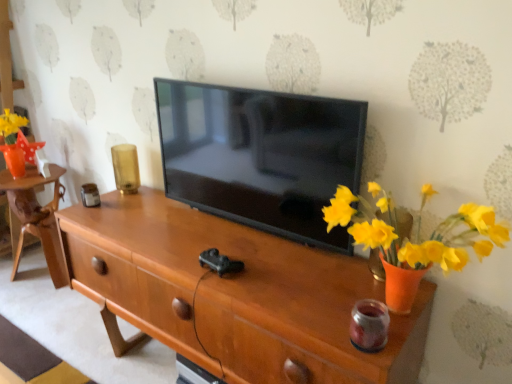
Locate an element on the screen. black glossy tv at center is located at coordinates (261, 156).

Image resolution: width=512 pixels, height=384 pixels. Describe the element at coordinates (6, 59) in the screenshot. I see `wooden cabinet at left` at that location.

Locate an element on the screen. wooden tv stand at center is located at coordinates (233, 295).

From the image's perspective, which is below, wooden table at left or wooden cabinet at left?

wooden table at left.

Is there a large distance between wooden table at left and wooden cabinet at left?

They are positioned close to each other.

Is point (60, 250) in front of point (14, 225)?

Yes, it is in front of point (14, 225).

Which object is thinner, wooden table at left or wooden cabinet at left?

With smaller width is wooden cabinet at left.

From a real-world perspective, is wooden tv stand at center located beneath wooden cabinet at left?

Yes, from a real-world perspective, wooden tv stand at center is under wooden cabinet at left.

Is wooden tv stand at center bigger than wooden cabinet at left?

Yes, wooden tv stand at center is bigger than wooden cabinet at left.

Is wooden tv stand at center outside of wooden cabinet at left?

Yes, wooden tv stand at center is located beyond the bounds of wooden cabinet at left.

Measure the distance between wooden tv stand at center and wooden cabinet at left.

wooden tv stand at center and wooden cabinet at left are 6.07 feet apart.

Is wooden table at left facing away from wooden tv stand at center?

That's not correct — wooden table at left is not looking away from wooden tv stand at center.

Where is `desk positioned vertically above the wooden table at left (from a real-world perspective)`? Image resolution: width=512 pixels, height=384 pixels. desk positioned vertically above the wooden table at left (from a real-world perspective) is located at coordinates (233, 295).

Which object is closer to the camera, wooden table at left or wooden tv stand at center?

wooden tv stand at center is in front.

The image size is (512, 384). I want to click on television above the wooden table at left (from the image's perspective), so click(261, 156).

Is wooden table at left taller than black glossy tv at center?

Correct, wooden table at left is much taller as black glossy tv at center.

Does point (31, 191) come behind point (211, 180)?

Yes, point (31, 191) is farther from viewer.

In the scene shown: Can you confirm if black glossy tv at center is taller than wooden cabinet at left?

In fact, black glossy tv at center may be shorter than wooden cabinet at left.

Are black glossy tv at center and wooden cabinet at left far apart?

black glossy tv at center is positioned a significant distance from wooden cabinet at left.

Does black glossy tv at center appear on the left side of wooden cabinet at left?

No, black glossy tv at center is not to the left of wooden cabinet at left.

Measure the distance from black glossy tv at center to wooden cabinet at left.

black glossy tv at center is 1.80 meters away from wooden cabinet at left.

Considering the relative positions of wooden tv stand at center and wooden table at left in the image provided, is wooden tv stand at center to the left of wooden table at left from the viewer's perspective?

Incorrect, wooden tv stand at center is not on the left side of wooden table at left.

Which is nearer, (338,256) or (59,261)?

Clearly, point (338,256) is closer to the camera than point (59,261).

The height and width of the screenshot is (384, 512). I want to click on table above the wooden tv stand at center (from the image's perspective), so click(38, 217).

Which of these two, wooden tv stand at center or black glossy tv at center, is wider?

Wider between the two is wooden tv stand at center.

Is wooden tv stand at center aimed at black glossy tv at center?

No, wooden tv stand at center is not turned towards black glossy tv at center.

Where is `cabinetry in front of the wooden table at left`? cabinetry in front of the wooden table at left is located at coordinates (6, 59).

Identify the location of cabinetry above the wooden tv stand at center (from the image's perspective). This screenshot has height=384, width=512. (6, 59).

Based on their spatial positions, is wooden table at left or wooden tv stand at center closer to black glossy tv at center?

Among the two, wooden tv stand at center is located nearer to black glossy tv at center.

Consider the image. From the image, which object appears to be farther from wooden cabinet at left, wooden tv stand at center or wooden table at left?

The object further to wooden cabinet at left is wooden tv stand at center.

Estimate the real-world distances between objects in this image. Which object is further from wooden table at left, black glossy tv at center or wooden tv stand at center?

black glossy tv at center is positioned further to the anchor wooden table at left.

Consider the image. From the image, which object appears to be nearer to wooden tv stand at center, black glossy tv at center or wooden table at left?

black glossy tv at center.

When comparing their distances from wooden table at left, does wooden tv stand at center or wooden cabinet at left seem closer?

wooden cabinet at left.

Consider the image. Considering their positions, is wooden cabinet at left positioned closer to black glossy tv at center than wooden tv stand at center?

Based on the image, wooden tv stand at center appears to be nearer to black glossy tv at center.

Considering their positions, is wooden cabinet at left positioned closer to wooden tv stand at center than wooden table at left?

wooden table at left is positioned closer to the anchor wooden tv stand at center.

When comparing their distances from wooden cabinet at left, does wooden table at left or black glossy tv at center seem closer?

The object closer to wooden cabinet at left is wooden table at left.

Where is `desk between wooden cabinet at left and black glossy tv at center from left to right`? This screenshot has height=384, width=512. desk between wooden cabinet at left and black glossy tv at center from left to right is located at coordinates (233, 295).

You are a GUI agent. You are given a task and a screenshot of the screen. Output one action in this format:
    pyautogui.click(x=<x>, y=<y>)
    Task: Click on the table between wooden cabinet at left and black glossy tv at center in the horizontal direction
    
    Given the screenshot: What is the action you would take?
    pyautogui.click(x=38, y=217)

Locate an element on the screen. table situated between wooden cabinet at left and wooden tv stand at center from left to right is located at coordinates (38, 217).

At what (x,y) coordinates should I click in order to perform the action: click on desk between wooden table at left and black glossy tv at center. Please return your answer as a coordinate pair (x, y). Looking at the image, I should click on (233, 295).